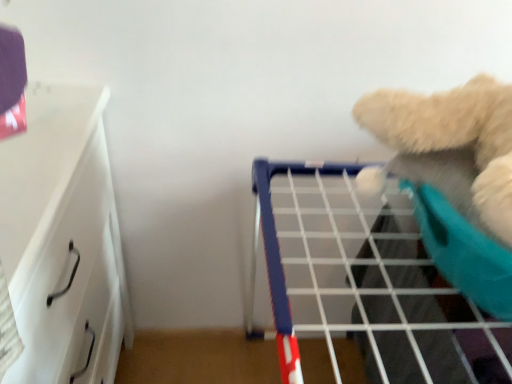
In order to face white wire shelf at upper right, should I rotate leftwards or rightwards?

Turn right approximately 13.422 degrees to face it.

This screenshot has width=512, height=384. What are the coordinates of `fluffy white teddy bear at upper right` in the screenshot? It's located at click(454, 135).

The image size is (512, 384). Describe the element at coordinates (63, 241) in the screenshot. I see `white glossy drawer at left` at that location.

Where is `white wire shelf at upper right`? Image resolution: width=512 pixels, height=384 pixels. white wire shelf at upper right is located at coordinates (376, 273).

Is white glossy drawer at left wider or thinner than white wire shelf at upper right?

white glossy drawer at left is thinner than white wire shelf at upper right.

Which object is more forward, white glossy drawer at left or white wire shelf at upper right?

white glossy drawer at left is more forward.

Is white glossy drawer at left positioned with its back to white wire shelf at upper right?

No, white glossy drawer at left is not facing away from white wire shelf at upper right.

From a real-world perspective, is white glossy drawer at left located higher than white wire shelf at upper right?

Yes, from a real-world perspective, white glossy drawer at left is above white wire shelf at upper right.

Is fluffy white teddy bear at upper right aimed at white glossy drawer at left?

No, fluffy white teddy bear at upper right is not oriented towards white glossy drawer at left.

Between fluffy white teddy bear at upper right and white glossy drawer at left, which one has less height?

With less height is fluffy white teddy bear at upper right.

Locate an element on the screen. This screenshot has height=384, width=512. furniture behind the fluffy white teddy bear at upper right is located at coordinates (63, 241).

Can you tell me how much fluffy white teddy bear at upper right and white glossy drawer at left differ in facing direction?

76.1 degrees.

From the picture: Is white wire shelf at upper right positioned far away from white glossy drawer at left?

No, there isn't a large distance between white wire shelf at upper right and white glossy drawer at left.

Is white wire shelf at upper right turned away from white glossy drawer at left?

Correct, white wire shelf at upper right is looking away from white glossy drawer at left.

Locate an element on the screen. The width and height of the screenshot is (512, 384). shelf directly beneath the white glossy drawer at left (from a real-world perspective) is located at coordinates (376, 273).

From a real-world perspective, is white wire shelf at upper right physically above white glossy drawer at left?

Actually, white wire shelf at upper right is physically below white glossy drawer at left in the real world.

How much distance is there between white glossy drawer at left and fluffy white teddy bear at upper right?

A distance of 23.62 inches exists between white glossy drawer at left and fluffy white teddy bear at upper right.

Can you see white glossy drawer at left touching fluffy white teddy bear at upper right?

No, white glossy drawer at left is not making contact with fluffy white teddy bear at upper right.

Which is more to the left, white glossy drawer at left or fluffy white teddy bear at upper right?

white glossy drawer at left.

Can you tell me how much white glossy drawer at left and fluffy white teddy bear at upper right differ in facing direction?

white glossy drawer at left and fluffy white teddy bear at upper right are facing 76.1 degrees away from each other.

Between fluffy white teddy bear at upper right and white wire shelf at upper right, which one has more height?

white wire shelf at upper right is taller.

Identify the location of shelf behind the fluffy white teddy bear at upper right. (376, 273).

Is fluffy white teddy bear at upper right inside or outside of white wire shelf at upper right?

fluffy white teddy bear at upper right is spatially situated outside white wire shelf at upper right.

Who is smaller, fluffy white teddy bear at upper right or white wire shelf at upper right?

With smaller size is fluffy white teddy bear at upper right.

Is white wire shelf at upper right far from fluffy white teddy bear at upper right?

white wire shelf at upper right is actually quite close to fluffy white teddy bear at upper right.

Can you tell me how much white wire shelf at upper right and fluffy white teddy bear at upper right differ in facing direction?

76.1 degrees.

Which is nearer, (416,230) or (390,130)?

The point (390,130) is closer to the camera.

In the image, is white wire shelf at upper right positioned in front of or behind fluffy white teddy bear at upper right?

white wire shelf at upper right is behind fluffy white teddy bear at upper right.

Identify the location of furniture in front of the white wire shelf at upper right. The image size is (512, 384). (63, 241).

At what (x,y) coordinates should I click in order to perform the action: click on furniture below the fluffy white teddy bear at upper right (from the image's perspective). Please return your answer as a coordinate pair (x, y). The height and width of the screenshot is (384, 512). Looking at the image, I should click on (63, 241).

From the image, which object appears to be nearer to white glossy drawer at left, fluffy white teddy bear at upper right or white wire shelf at upper right?

white wire shelf at upper right lies closer to white glossy drawer at left than the other object.

Estimate the real-world distances between objects in this image. Which object is further from white wire shelf at upper right, white glossy drawer at left or fluffy white teddy bear at upper right?

white glossy drawer at left lies further to white wire shelf at upper right than the other object.

Which object lies further to the anchor point fluffy white teddy bear at upper right, white wire shelf at upper right or white glossy drawer at left?

Based on the image, white glossy drawer at left appears to be further to fluffy white teddy bear at upper right.

When comparing their distances from white glossy drawer at left, does white wire shelf at upper right or fluffy white teddy bear at upper right seem closer?

white wire shelf at upper right.

Estimate the real-world distances between objects in this image. Which object is closer to fluffy white teddy bear at upper right, white glossy drawer at left or white wire shelf at upper right?

white wire shelf at upper right is positioned closer to the anchor fluffy white teddy bear at upper right.

Estimate the real-world distances between objects in this image. Which object is further from white wire shelf at upper right, fluffy white teddy bear at upper right or white glossy drawer at left?

Based on the image, white glossy drawer at left appears to be further to white wire shelf at upper right.

Image resolution: width=512 pixels, height=384 pixels. I want to click on shelf between white glossy drawer at left and fluffy white teddy bear at upper right in the horizontal direction, so click(376, 273).